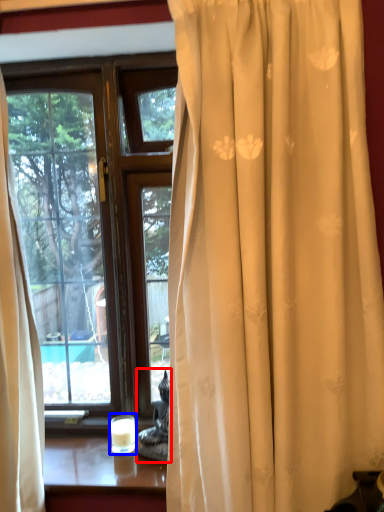
Question: Which object appears closest to the camera in this image, chair (highlighted by a red box) or candle holder (highlighted by a blue box)?

Choices:
 (A) chair
 (B) candle holder

Answer: (A)